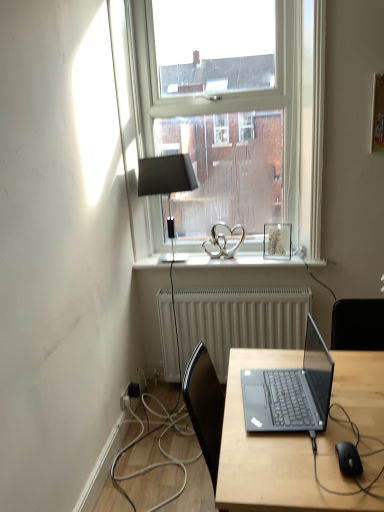
The width and height of the screenshot is (384, 512). What are the coordinates of `unoccupied space behind sleek black laptop at center` in the screenshot? It's located at (294, 362).